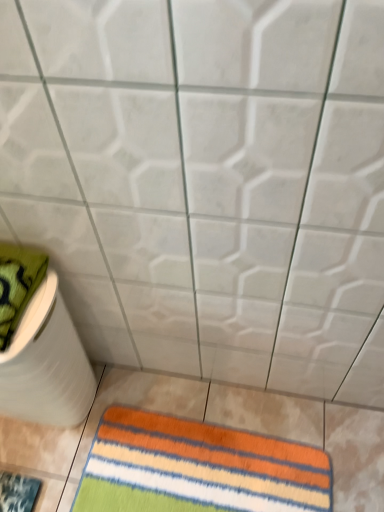
What do you see at coordinates (18, 284) in the screenshot? This screenshot has width=384, height=512. I see `green textured towel at left` at bounding box center [18, 284].

Identify the location of white matte toilet paper at lower left. The image size is (384, 512). (46, 364).

This screenshot has height=512, width=384. Describe the element at coordinates (197, 468) in the screenshot. I see `multicolored striped rug at lower center` at that location.

Measure the distance between multicolored striped rug at lower left and camera.

The distance of multicolored striped rug at lower left from camera is 1.14 meters.

At what (x,y) coordinates should I click in order to perform the action: click on green textured towel at left. Please return your answer as a coordinate pair (x, y). This screenshot has height=512, width=384. Looking at the image, I should click on (18, 284).

How many degrees apart are the facing directions of green textured towel at left and white matte toilet paper at lower left?

They differ by 2.46e-05 degrees in their facing directions.

Could you tell me if green textured towel at left is turned towards white matte toilet paper at lower left?

No, green textured towel at left is not aimed at white matte toilet paper at lower left.

Based on the photo, from the image's perspective, who appears lower, green textured towel at left or white matte toilet paper at lower left?

white matte toilet paper at lower left.

Is green textured towel at left not within white matte toilet paper at lower left?

green textured towel at left lies outside white matte toilet paper at lower left's area.

Find the location of a particular element. toilet paper in front of the multicolored striped rug at lower left is located at coordinates (46, 364).

Is multicolored striped rug at lower left to the left or to the right of white matte toilet paper at lower left in the image?

In the image, multicolored striped rug at lower left appears on the left side of white matte toilet paper at lower left.

From the image's perspective, which object appears higher, multicolored striped rug at lower left or white matte toilet paper at lower left?

white matte toilet paper at lower left.

In the scene shown: Is multicolored striped rug at lower left next to white matte toilet paper at lower left?

They are not placed beside each other.

Is green textured towel at left oriented away from multicolored striped rug at lower center?

No.

Visually, is green textured towel at left positioned to the left or to the right of multicolored striped rug at lower center?

green textured towel at left is positioned on multicolored striped rug at lower center's left side.

Is green textured towel at left not inside multicolored striped rug at lower center?

That's correct, green textured towel at left is outside of multicolored striped rug at lower center.

Which is behind, green textured towel at left or multicolored striped rug at lower center?

multicolored striped rug at lower center is more distant.

Which object is thinner, multicolored striped rug at lower center or multicolored striped rug at lower left?

multicolored striped rug at lower center.

How many degrees apart are the facing directions of multicolored striped rug at lower center and multicolored striped rug at lower left?

91.8 degrees.

Locate an element on the screen. towel lying on the right of multicolored striped rug at lower left is located at coordinates (197, 468).

Consider the image. Does multicolored striped rug at lower center come behind multicolored striped rug at lower left?

Yes, multicolored striped rug at lower center is further from the camera.

Is multicolored striped rug at lower center bigger than green textured towel at left?

No, multicolored striped rug at lower center is not bigger than green textured towel at left.

From the image's perspective, which one is positioned higher, multicolored striped rug at lower center or green textured towel at left?

green textured towel at left appears higher in the image.

How different are the orientations of multicolored striped rug at lower center and green textured towel at left in degrees?

multicolored striped rug at lower center and green textured towel at left are facing 0.133 degrees away from each other.

Is multicolored striped rug at lower center positioned with its back to green textured towel at left?

That's not correct — multicolored striped rug at lower center is not looking away from green textured towel at left.

Which is correct: white matte toilet paper at lower left is inside green textured towel at left, or outside of it?

white matte toilet paper at lower left cannot be found inside green textured towel at left.

You are a GUI agent. You are given a task and a screenshot of the screen. Output one action in this format:
    pyautogui.click(x=<x>, y=<y>)
    Task: Click on the beach towel that is above the white matte toilet paper at lower left (from the image's perspective)
    Image resolution: width=384 pixels, height=512 pixels.
    Given the screenshot: What is the action you would take?
    pyautogui.click(x=18, y=284)

Which object is more forward, white matte toilet paper at lower left or green textured towel at left?

green textured towel at left is closer to the camera.

Measure the distance from white matte toilet paper at lower left to green textured towel at left.

A distance of 8.63 inches exists between white matte toilet paper at lower left and green textured towel at left.

Measure the distance from green textured towel at left to multicolored striped rug at lower left.

green textured towel at left is 25.03 inches away from multicolored striped rug at lower left.

Considering the points (4, 345) and (35, 489), which point is in front, point (4, 345) or point (35, 489)?

The point (4, 345) is in front.

Can you confirm if green textured towel at left is smaller than multicolored striped rug at lower left?

Incorrect, green textured towel at left is not smaller in size than multicolored striped rug at lower left.

Is green textured towel at left beside multicolored striped rug at lower left?

green textured towel at left is not next to multicolored striped rug at lower left, and they're not touching.

Where is `beach towel located above the white matte toilet paper at lower left (from a real-world perspective)`? The image size is (384, 512). beach towel located above the white matte toilet paper at lower left (from a real-world perspective) is located at coordinates (18, 284).

The height and width of the screenshot is (512, 384). I want to click on mat lying below the white matte toilet paper at lower left (from the image's perspective), so click(x=17, y=492).

Based on the photo, estimate the real-world distances between objects in this image. Which object is closer to multicolored striped rug at lower left, white matte toilet paper at lower left or green textured towel at left?

white matte toilet paper at lower left lies closer to multicolored striped rug at lower left than the other object.

Considering their positions, is white matte toilet paper at lower left positioned closer to multicolored striped rug at lower center than green textured towel at left?

white matte toilet paper at lower left.

Based on their spatial positions, is multicolored striped rug at lower center or green textured towel at left closer to white matte toilet paper at lower left?

Based on the image, green textured towel at left appears to be nearer to white matte toilet paper at lower left.

Looking at the image, which one is located closer to multicolored striped rug at lower center, multicolored striped rug at lower left or white matte toilet paper at lower left?

white matte toilet paper at lower left is closer to multicolored striped rug at lower center.

Based on their spatial positions, is green textured towel at left or multicolored striped rug at lower left closer to multicolored striped rug at lower center?

multicolored striped rug at lower left.

Looking at this image, estimate the real-world distances between objects in this image. Which object is closer to green textured towel at left, white matte toilet paper at lower left or multicolored striped rug at lower center?

white matte toilet paper at lower left is closer to green textured towel at left.

Which object lies nearer to the anchor point multicolored striped rug at lower left, multicolored striped rug at lower center or green textured towel at left?

Based on the image, multicolored striped rug at lower center appears to be nearer to multicolored striped rug at lower left.

Consider the image. Considering their positions, is multicolored striped rug at lower left positioned further to multicolored striped rug at lower center than green textured towel at left?

green textured towel at left lies further to multicolored striped rug at lower center than the other object.

Where is `toilet paper between green textured towel at left and multicolored striped rug at lower center in the horizontal direction`? toilet paper between green textured towel at left and multicolored striped rug at lower center in the horizontal direction is located at coordinates (46, 364).

Identify the location of toilet paper located between multicolored striped rug at lower left and multicolored striped rug at lower center in the left-right direction. (46, 364).

Where is `toilet paper between green textured towel at left and multicolored striped rug at lower left from top to bottom`? This screenshot has height=512, width=384. toilet paper between green textured towel at left and multicolored striped rug at lower left from top to bottom is located at coordinates (46, 364).

Identify the location of towel that lies between green textured towel at left and multicolored striped rug at lower left from top to bottom. The image size is (384, 512). (197, 468).